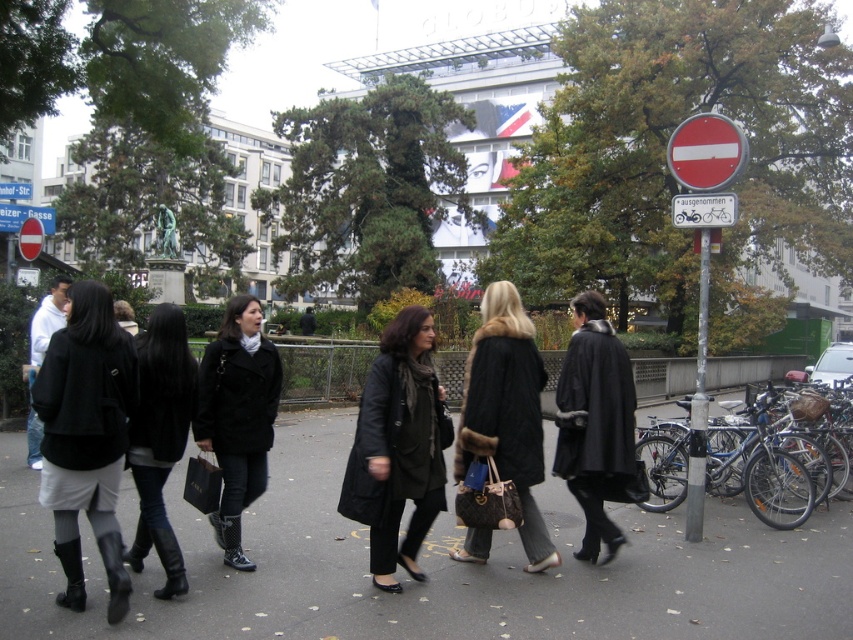
Question: Estimate the real-world distances between objects in this image. Which object is farther from the black matte coat at lower left?

Choices:
 (A) red plastic bicycle at upper right
 (B) red matte sign at upper right
 (C) red plastic sign at upper center

Answer: (C)

Question: Can you confirm if black asphalt at center is positioned below red matte sign at upper right?

Choices:
 (A) no
 (B) yes

Answer: (B)

Question: Can you confirm if matte black coat at center is positioned above black matte coat at center?

Choices:
 (A) no
 (B) yes

Answer: (A)

Question: Which object appears closest to the camera in this image?

Choices:
 (A) black fur-trimmed coat at center
 (B) black matte coat at center
 (C) red matte sign at upper right

Answer: (B)

Question: Which object is farther from the camera taking this photo?

Choices:
 (A) black matte coat at lower left
 (B) red plastic sign at upper center
 (C) red plastic sign at upper left
 (D) black fur-trimmed coat at center

Answer: (B)

Question: Can you confirm if black asphalt at center is positioned to the left of brown fur coat at center?

Choices:
 (A) yes
 (B) no

Answer: (A)